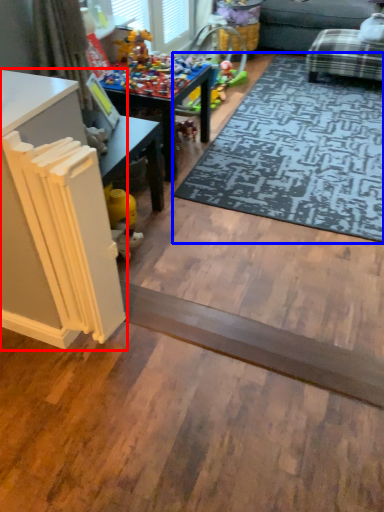
Question: Among these objects, which one is nearest to the camera, table (highlighted by a red box) or mat (highlighted by a blue box)?

Choices:
 (A) table
 (B) mat

Answer: (A)